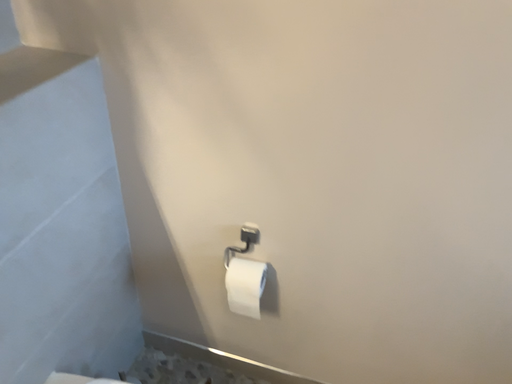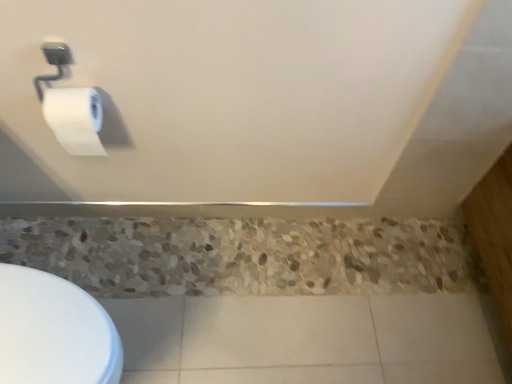
Question: Which way did the camera rotate in the video?

Choices:
 (A) rotated downward
 (B) rotated upward

Answer: (A)